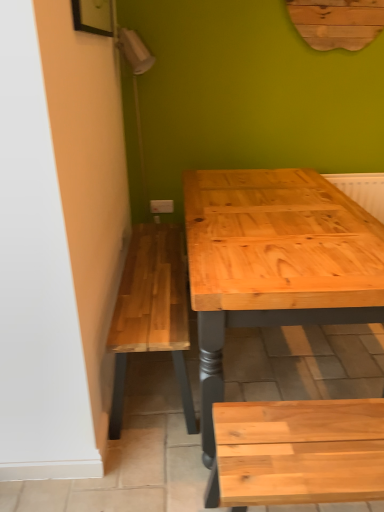
The height and width of the screenshot is (512, 384). Identify the location of free spot above natural wood bench at lower right (from a real-world perspective). (316, 439).